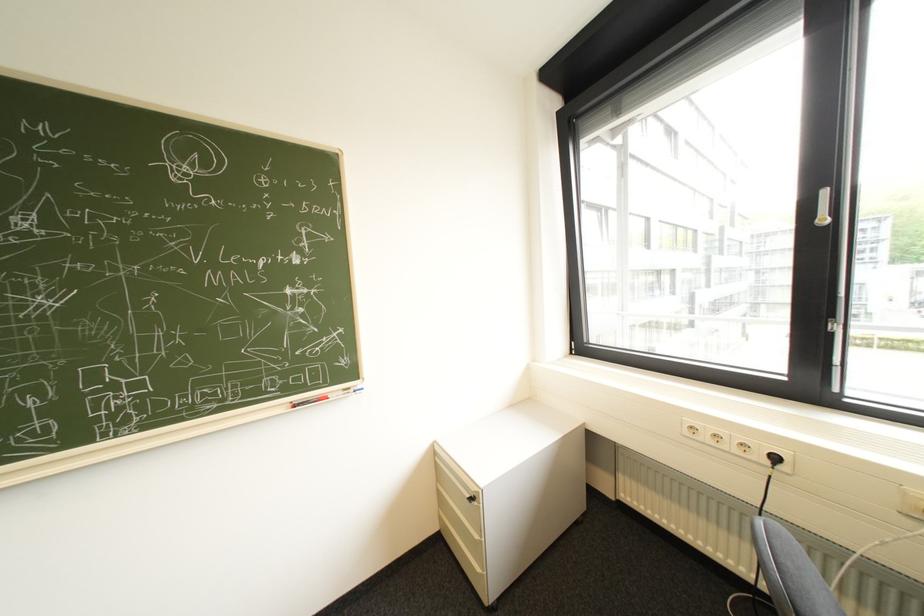
The height and width of the screenshot is (616, 924). I want to click on white window handle, so click(x=842, y=201).